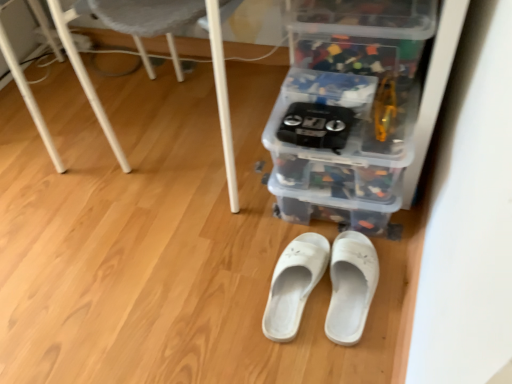
Locate an element on the screen. Image resolution: width=512 pixels, height=384 pixels. free space to the left of white fabric slippers at center, placed as the second footwear when sorted from right to left is located at coordinates (216, 293).